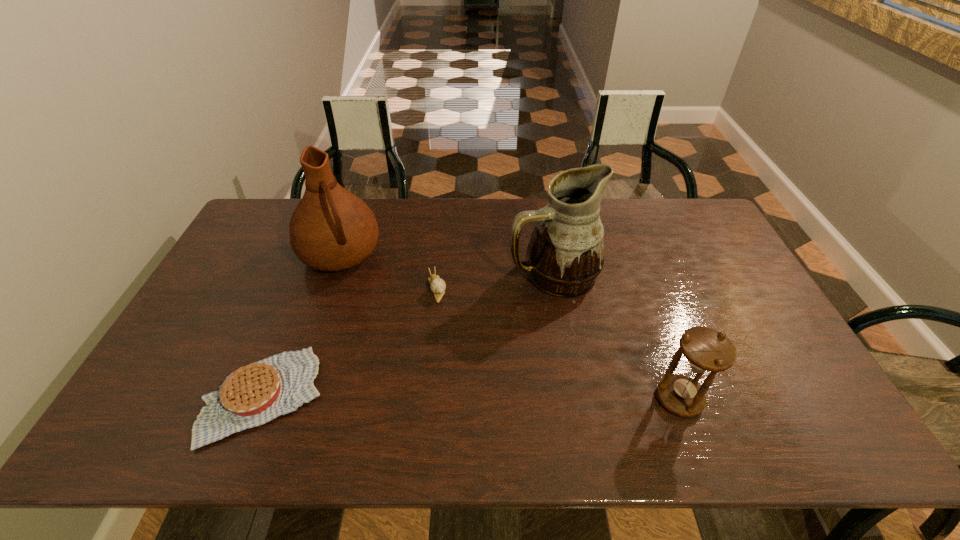
Find the location of a particular element. The image size is (960, 540). vacant space on the desktop that is between the pie and the hourglass and is positioned on the shell of the escargot is located at coordinates (479, 397).

At what (x,y) coordinates should I click in order to perform the action: click on vacant space on the desktop that is between the pie and the third shortest object and is positioned on the side of the left pitcher with the handle. Please return your answer as a coordinate pair (x, y). Looking at the image, I should click on point(409,397).

Where is `free spot on the desktop that is between the pie and the third shortest object and is positioned from the spout of the fourth object from left to right`? The height and width of the screenshot is (540, 960). free spot on the desktop that is between the pie and the third shortest object and is positioned from the spout of the fourth object from left to right is located at coordinates (459, 397).